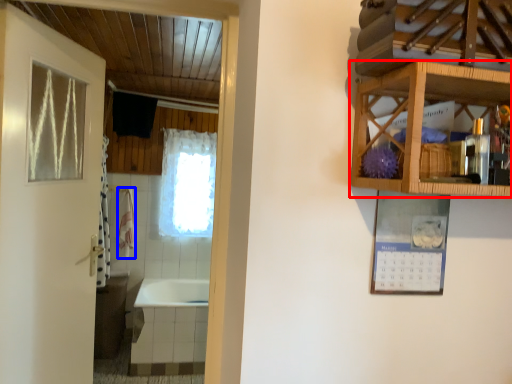
Question: Among these objects, which one is farthest to the camera, cabinetry (highlighted by a red box) or towel/napkin (highlighted by a blue box)?

Choices:
 (A) cabinetry
 (B) towel/napkin

Answer: (B)